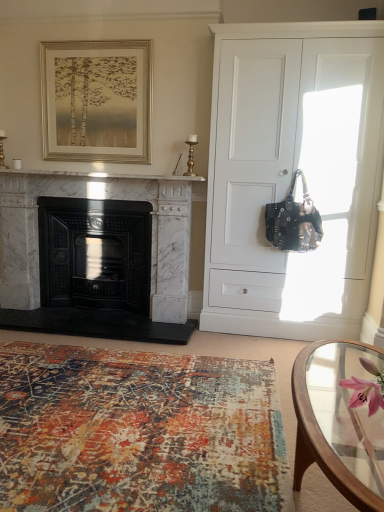
Question: Which is correct: textured rug at lower left is inside gold-toned wooden frame at upper center, or outside of it?

Choices:
 (A) outside
 (B) inside

Answer: (A)

Question: Is point (205, 430) closer or farther from the camera than point (140, 119)?

Choices:
 (A) closer
 (B) farther

Answer: (A)

Question: Estimate the real-world distances between objects in this image. Which object is closer to the white marble fireplace at left, the first fireplace in the right-to-left sequence?

Choices:
 (A) gold-toned wooden frame at upper center
 (B) textured rug at lower left
 (C) black leather handbag at right
 (D) white matte cabinet at right
 (E) pink silk flower at lower right

Answer: (A)

Question: Which object is positioned closest to the pink silk flower at lower right?

Choices:
 (A) black cast iron fireplace at left, which is counted as the 2th fireplace, starting from the right
 (B) textured rug at lower left
 (C) black leather handbag at right
 (D) clear glass coffee table at lower right
 (E) white marble fireplace at left, the first fireplace in the right-to-left sequence

Answer: (D)